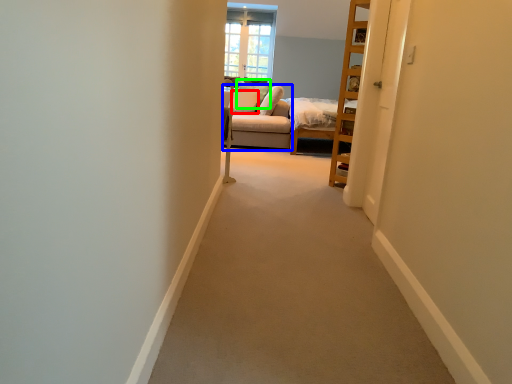
Question: Which is nearer to the pillow (highlighted by a red box)? couch (highlighted by a blue box) or pillow (highlighted by a green box).

Choices:
 (A) couch
 (B) pillow

Answer: (B)